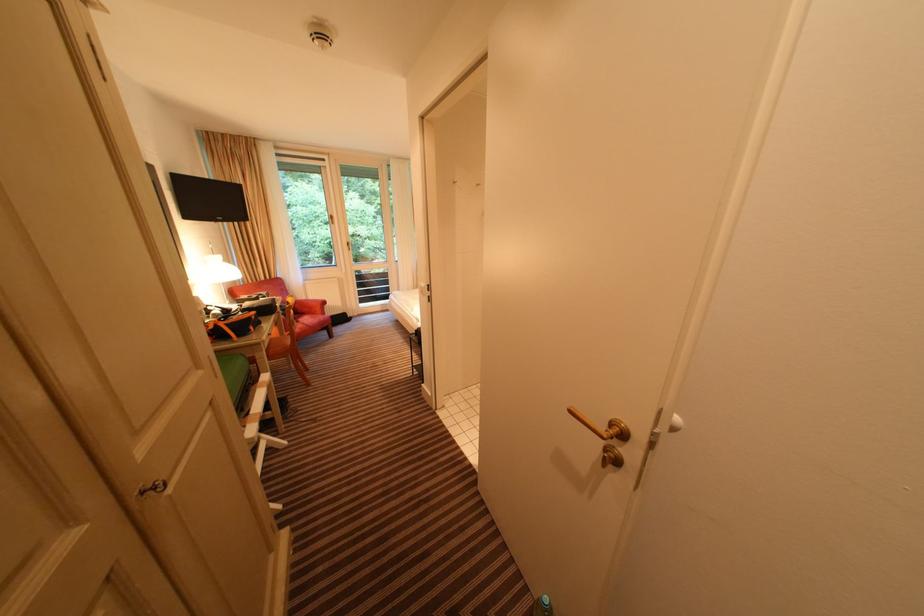
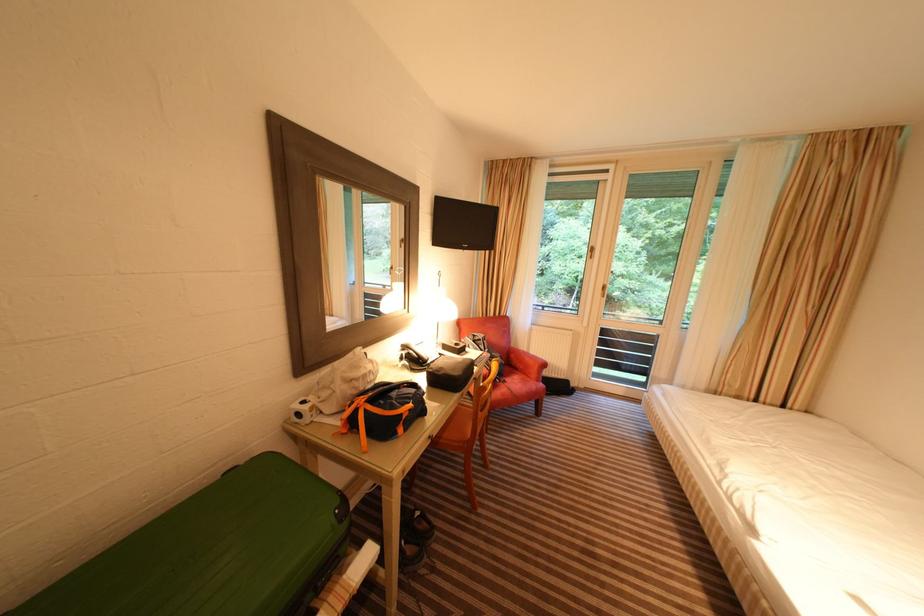
The point at (257, 320) is marked in the first image. Where is the corresponding point in the second image?

(407, 416)